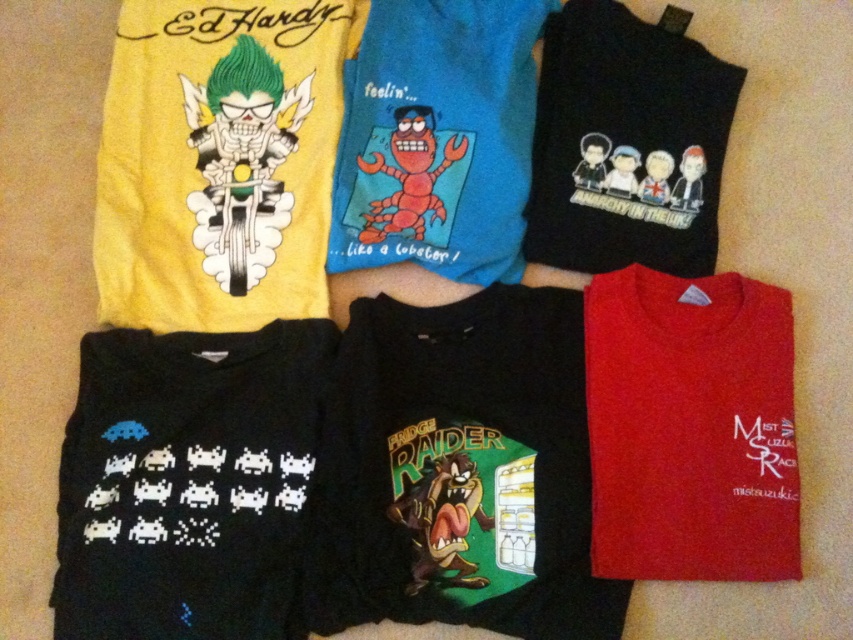
You are standing 1.2 meters away from the camera. Can you reach the point at coordinates point (583, 637) without moving your position?

The distance of point (583, 637) from camera is 1.17 meters. Since you are standing 1.2 meters away from the camera, you can reach the point at coordinates point (583, 637) without moving your position because it is slightly closer to you than your current distance.

You are standing in front of the six folded tshirts arranged in two rows. You want to pick up the shirt at point (544, 372) and the shirt at point (146, 595). Which shirt will you need to reach further back to pick up?

The point (146, 595) is closer to the camera than point (544, 372), so you will need to reach further back to pick up the shirt at point (544, 372).